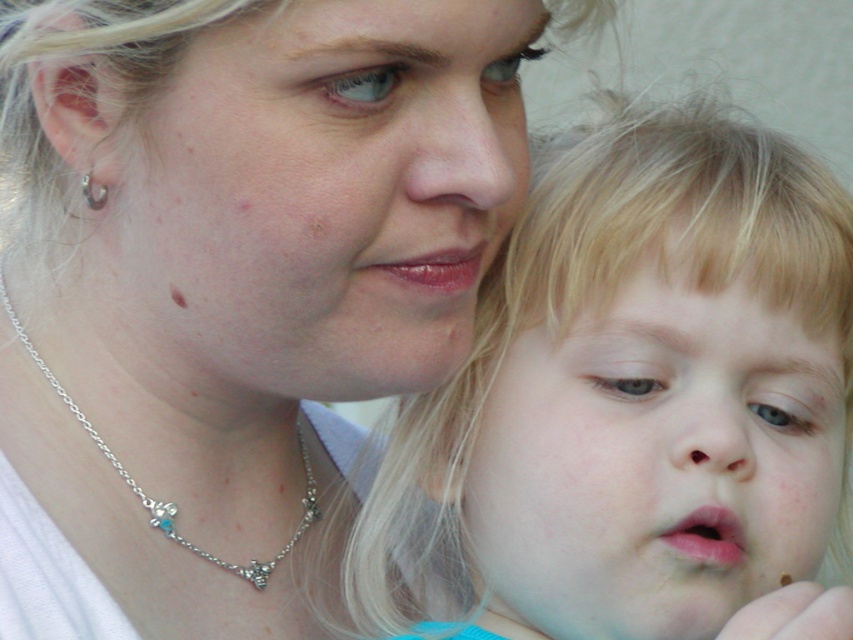
Is point (705, 362) in front of point (300, 433)?

Yes, it is in front of point (300, 433).

Measure the distance from smooth blonde hair at center to silver/glass necklace at center.

They are 8.53 inches apart.

Is point (698, 458) behind point (305, 456)?

No, it is not.

I want to click on smooth blonde hair at center, so click(630, 396).

Is point (669, 528) positioned in front of point (424, 260)?

Yes.

Locate an element on the screen. matte pink lips at lower center is located at coordinates (706, 536).

Looking at this image, can you confirm if matte silver necklace at center is positioned to the right of silver/glass necklace at center?

Correct, you'll find matte silver necklace at center to the right of silver/glass necklace at center.

Is point (218, 289) farther from viewer compared to point (256, 563)?

No.

Is point (427, 339) positioned after point (294, 531)?

No.

Find the location of `matte silver necklace at center`. matte silver necklace at center is located at coordinates (227, 282).